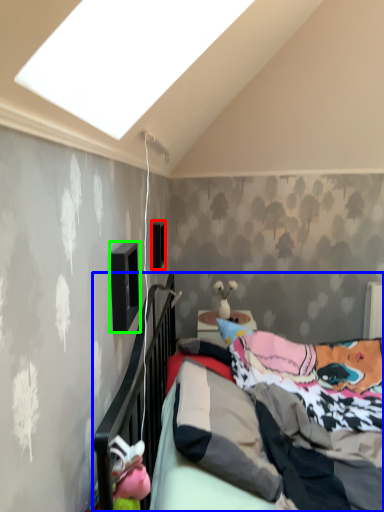
Question: Which is nearer to the window (highlighted by a red box)? bed (highlighted by a blue box) or window (highlighted by a green box).

Choices:
 (A) bed
 (B) window

Answer: (A)